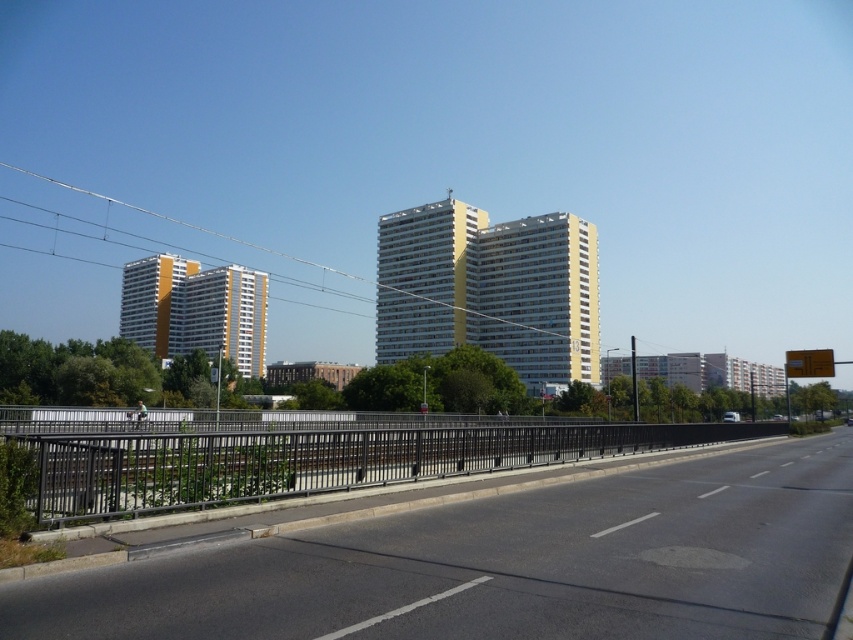
You are a drone operator who needs to fly a drone from the metallic wire at upper center to the black asphalt highway at center. Given that your drone has a maximum flight range of 110 meters, will it be able to reach the highway without needing a recharge?

The distance between the metallic wire at upper center and the black asphalt highway at center is 111.28 meters, which exceeds the drone operator stated maximum flight range of 110 meters. Therefore, the drone will not be able to reach the black asphalt highway at center without needing a recharge.

You are a delivery driver who needs to deliver a package to the address located at point 0.884, 0.596. The black asphalt highway at center is your current location. Can you reach the destination directly from your current position without leaving the highway?

Yes, the destination is located at point (508, 564) on the black asphalt highway at center, so you can reach it directly without leaving the highway.